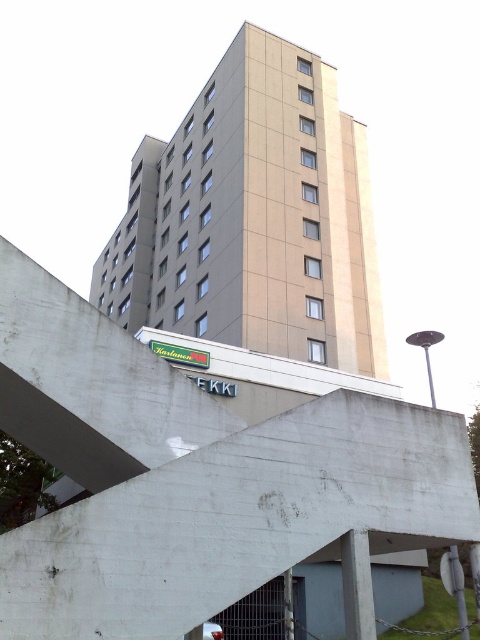
You are standing at the base of the multi story building and looking up. There is a point marked at coordinate (204, 472). What is located at that point?

The point at coordinate (204, 472) indicates concrete at center.

You are standing on the sidewalk and see the concrete at center and the beige concrete building at center. Which one is taller?

The beige concrete building at center is taller than the concrete at center.

You are a delivery person trying to park your van between the concrete at center and the beige concrete building at center. Can your van fit in the space between them if the van is 2 meters wide?

The concrete at center is thinner than beige concrete building at center, but without specific measurements, it is impossible to determine if the space between them is wide enough for a 2 meter wide van.